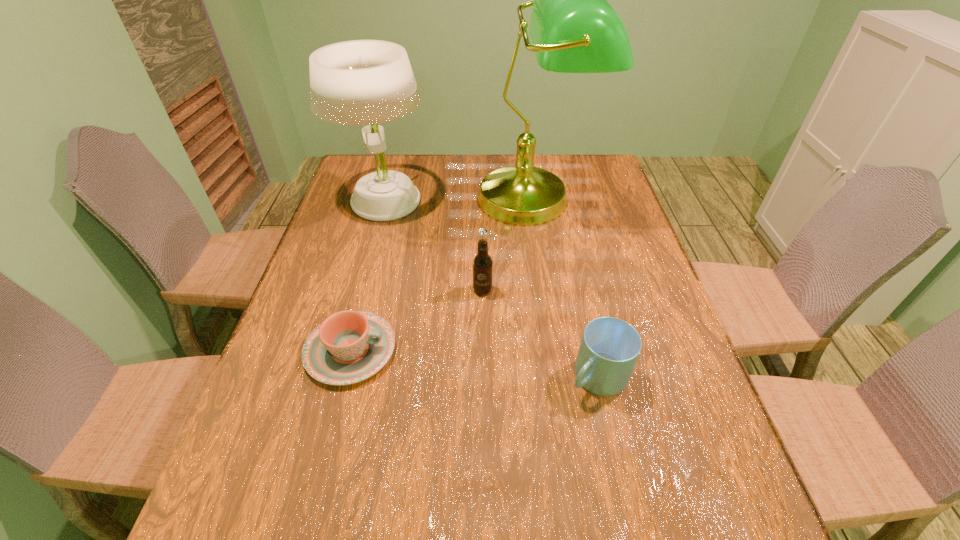
Where is `vacant point located between the mug and the chinaware`? The image size is (960, 540). vacant point located between the mug and the chinaware is located at coordinates 474,364.

Identify the location of empty space that is in between the shortest object and the second shortest object. Image resolution: width=960 pixels, height=540 pixels. (474, 364).

Where is `free space between the fourth shortest object and the tallest object`? Image resolution: width=960 pixels, height=540 pixels. free space between the fourth shortest object and the tallest object is located at coordinates pos(459,200).

Identify which object is located as the fourth nearest to the tallest object. Please provide its 2D coordinates. Your answer should be formatted as a tuple, i.e. [(x, y)], where the tuple contains the x and y coordinates of a point satisfying the conditions above.

[(609, 349)]

Select which object is the closest to the shortest object. Please provide its 2D coordinates. Your answer should be formatted as a tuple, i.e. [(x, y)], where the tuple contains the x and y coordinates of a point satisfying the conditions above.

[(482, 262)]

Locate an element on the screen. The width and height of the screenshot is (960, 540). free location that satisfies the following two spatial constraints: 1. on the handle side of the mug; 2. on the right side of the shortest object is located at coordinates (344, 377).

In order to click on free space that satisfies the following two spatial constraints: 1. on the label of the third farthest object; 2. on the handle side of the chinaware in this screenshot , I will do `click(483, 350)`.

This screenshot has height=540, width=960. I want to click on vacant position in the image that satisfies the following two spatial constraints: 1. on the desk next to the right lamp; 2. on the handle side of the chinaware, so click(x=557, y=350).

I want to click on vacant space that satisfies the following two spatial constraints: 1. on the label of the third nearest object; 2. on the handle side of the shortest object, so click(483, 350).

Identify the location of vacant space that satisfies the following two spatial constraints: 1. on the handle side of the shortest object; 2. on the left side of the fourth tallest object. The width and height of the screenshot is (960, 540). (344, 377).